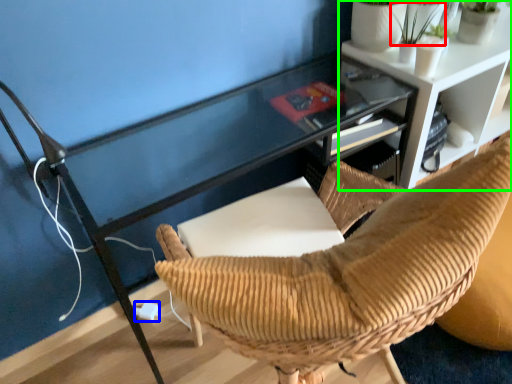
Question: Estimate the real-world distances between objects in this image. Which object is closer to plant (highlighted by a red box), plug (highlighted by a blue box) or shelf (highlighted by a green box)?

Choices:
 (A) plug
 (B) shelf

Answer: (B)